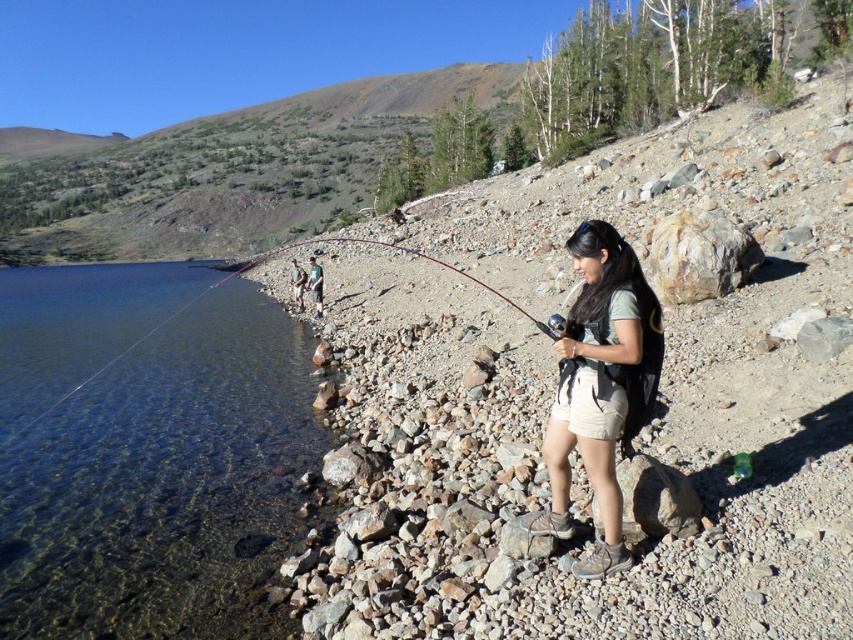
You are standing at point (299,284) and want to move towards the woman holding the fishing rod. Is the point (312,262) in front of you or behind you?

The point (312,262) is in front of point (299,284), so if you are standing at point (299,284) and moving toward the woman, the point (312,262) would be in front of you.

In the scene shown: You are a photographer trying to capture the woman in the scene. To avoid blocking the view of the lake behind her, you need to know which item is shorter so you can position your camera accordingly. Which item between the matte gray shirt at center and the green fabric backpack at center is shorter?

The matte gray shirt at center is shorter than the green fabric backpack at center, so you should position your camera to focus on the shorter item to avoid blocking the lake view.

You are an outdoor enthusiast planning to hike and fish. You have a green fabric backpack at center and a green fabric shirt at center. Which item is narrower in width?

The green fabric backpack at center has a lesser width compared to the green fabric shirt at center, so the backpack is narrower.